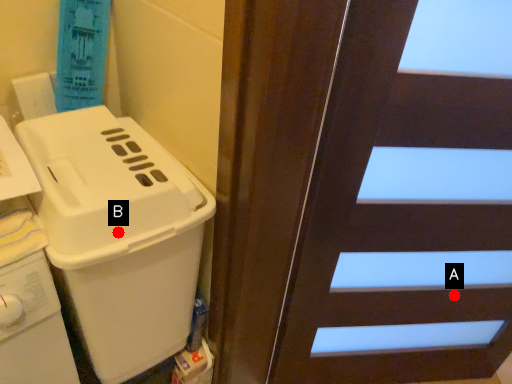
Question: Two points are circled on the image, labeled by A and B beside each circle. Which point is farther from the camera taking this photo?

Choices:
 (A) A is further
 (B) B is further

Answer: (A)